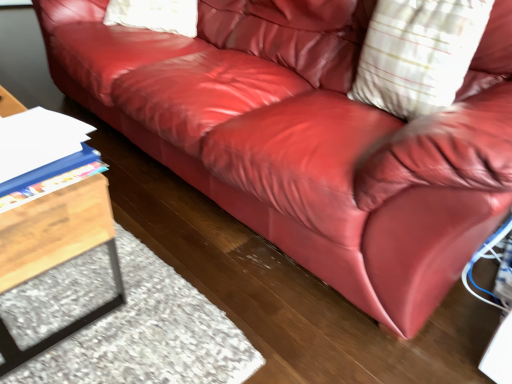
This screenshot has width=512, height=384. What are the coordinates of `vacant area that is situated to the right of wooden table at left` in the screenshot? It's located at (205, 251).